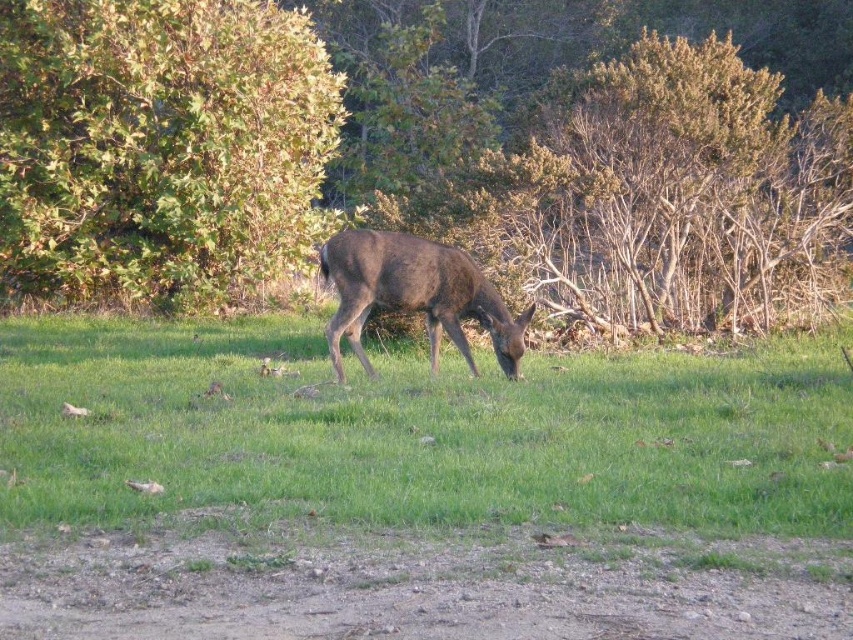
In the scene shown: You are a photographer aiming to capture the brown matte deer at center while ensuring the green leafy tree at upper left is visible in the frame. Given their relative widths, which object will occupy more space in your photo?

The green leafy tree at upper left will occupy more space in the photo because its width surpasses that of the brown matte deer at center.

You are standing in a natural setting and see a deer grazing in the center. There is a specific point marked at coordinates point (259, 180). If you want to take a photo of the deer without disturbing it, should you move closer or stay at your current position to ensure the deer remains in focus?

The distance of point (259, 180) from the camera is 14.74 meters. To keep the deer in focus while avoiding disturbance, it is advisable to stay at your current position since moving closer might startle the animal.